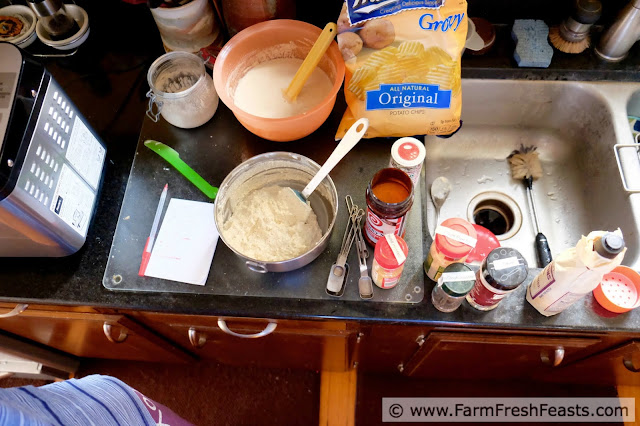
Locate an element on the screen. The width and height of the screenshot is (640, 426). yellow spoon handle is located at coordinates (308, 61).